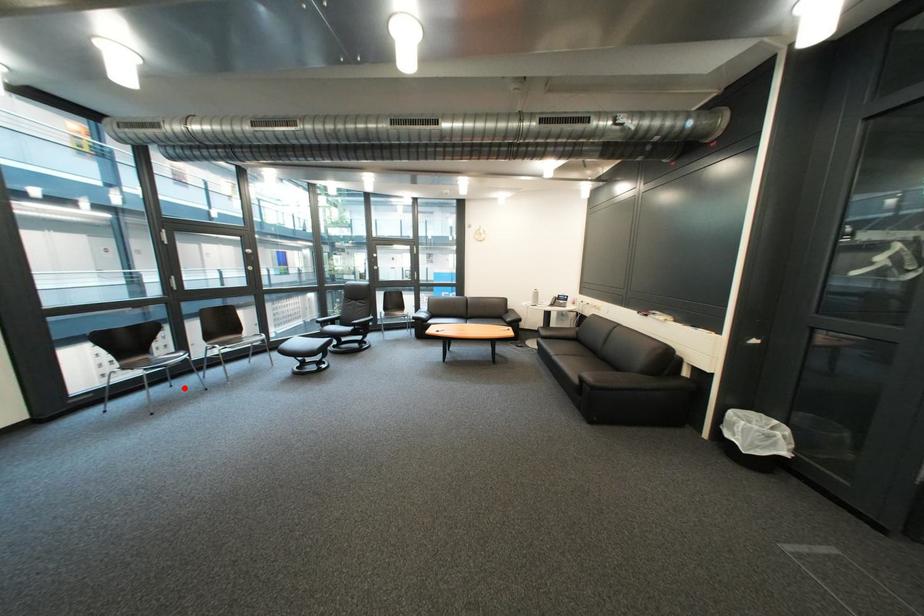
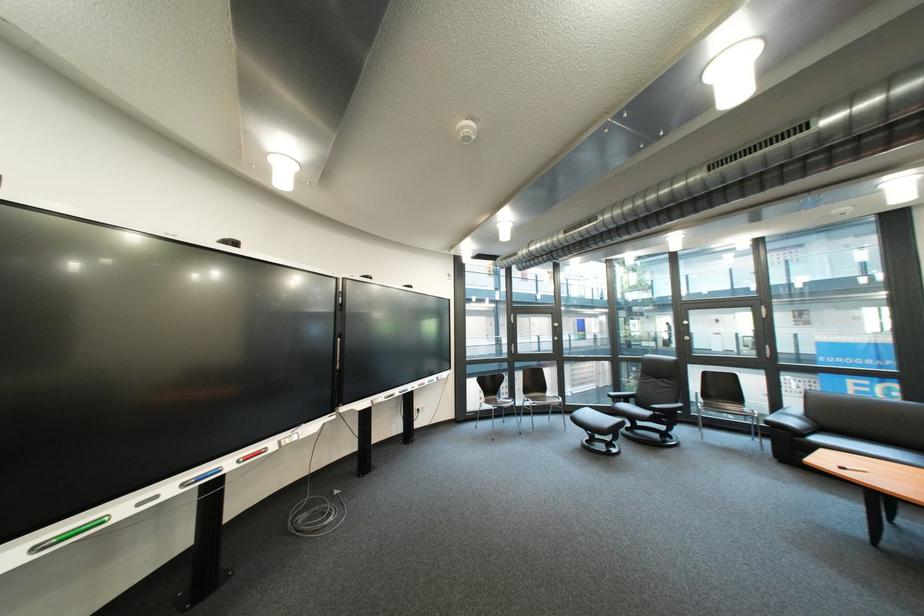
Where in the second image is the point corresponding to the highlighted location from the first image?

(517, 424)